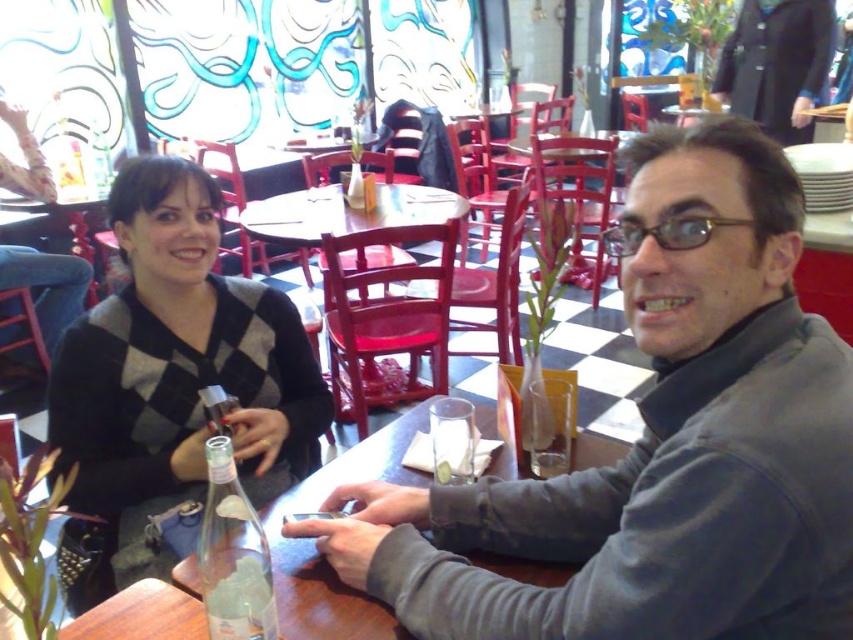
Question: Which object is closer to the camera taking this photo?

Choices:
 (A) clear glass table at center
 (B) black knit sweater at upper left
 (C) gray matte jacket at center

Answer: (C)

Question: Observing the image, what is the correct spatial positioning of black knit sweater at upper left in reference to clear glass bottle at table center?

Choices:
 (A) right
 (B) left

Answer: (B)

Question: Which point is farther to the camera?

Choices:
 (A) (172, 604)
 (B) (723, 544)
 (C) (321, 189)
 (D) (206, 346)

Answer: (C)

Question: Does gray matte jacket at center appear over clear glass table at center?

Choices:
 (A) yes
 (B) no

Answer: (A)

Question: Can you confirm if clear glass table at center is bigger than clear glass bottle at table center?

Choices:
 (A) yes
 (B) no

Answer: (A)

Question: Among these objects, which one is nearest to the camera?

Choices:
 (A) gray matte jacket at center
 (B) clear glass bottle at table center
 (C) black knit sweater at upper left

Answer: (A)